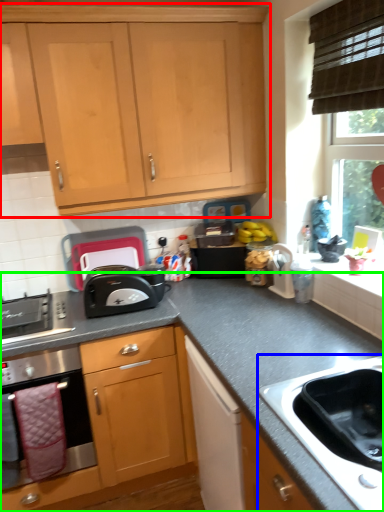
Question: Considering the real-world distances, which object is farthest from cabinetry (highlighted by a red box)? sink (highlighted by a blue box) or countertop (highlighted by a green box)?

Choices:
 (A) sink
 (B) countertop

Answer: (A)